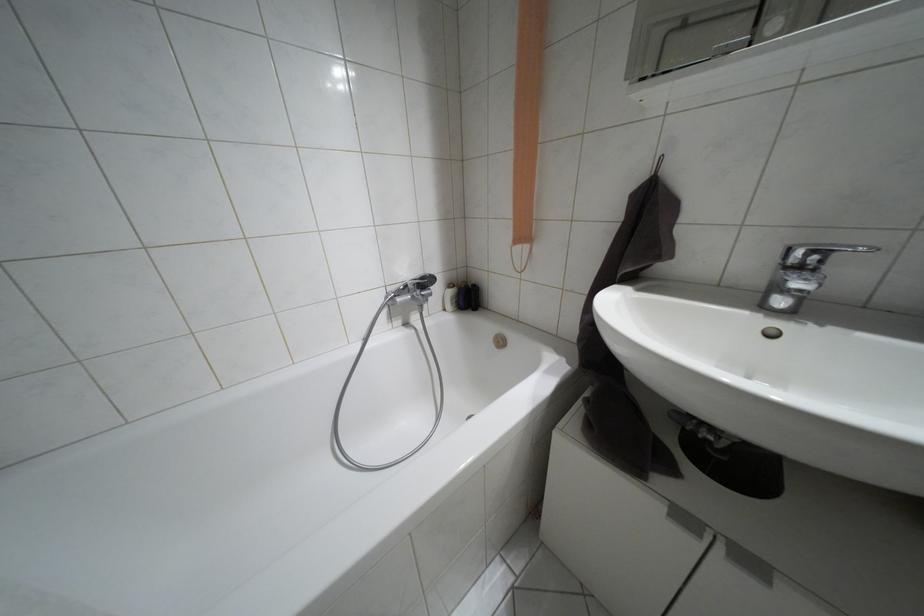
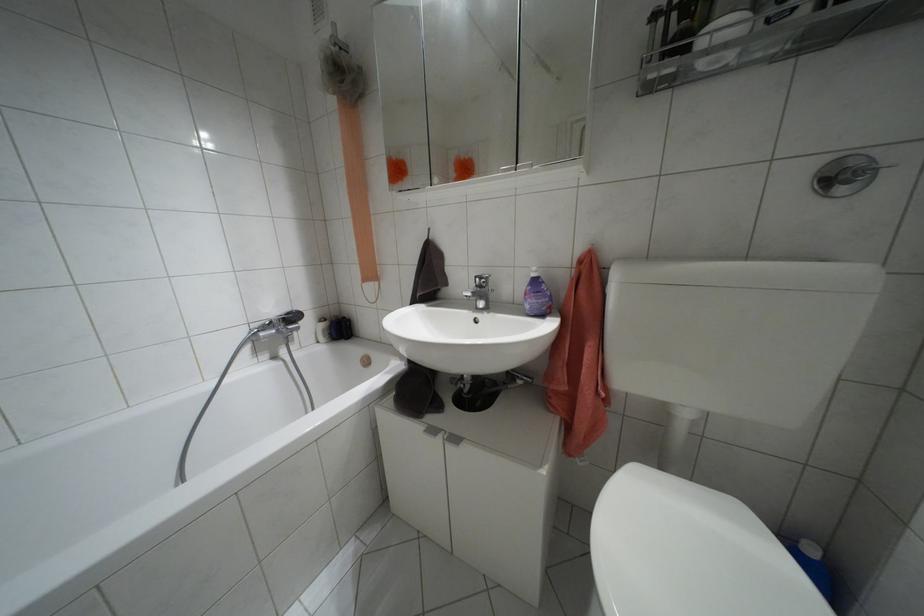
The point at (420, 277) is marked in the first image. Where is the corresponding point in the second image?

(286, 313)